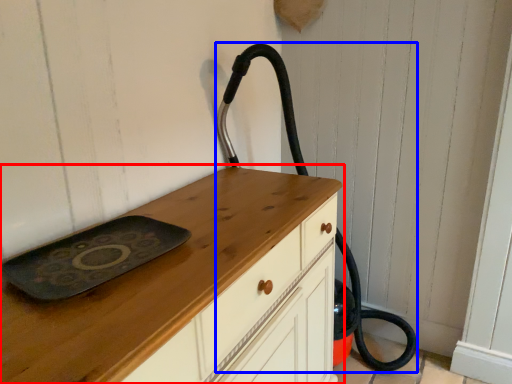
Question: Which object is closer to the camera taking this photo, chest of drawers (highlighted by a red box) or fire hose (highlighted by a blue box)?

Choices:
 (A) chest of drawers
 (B) fire hose

Answer: (A)